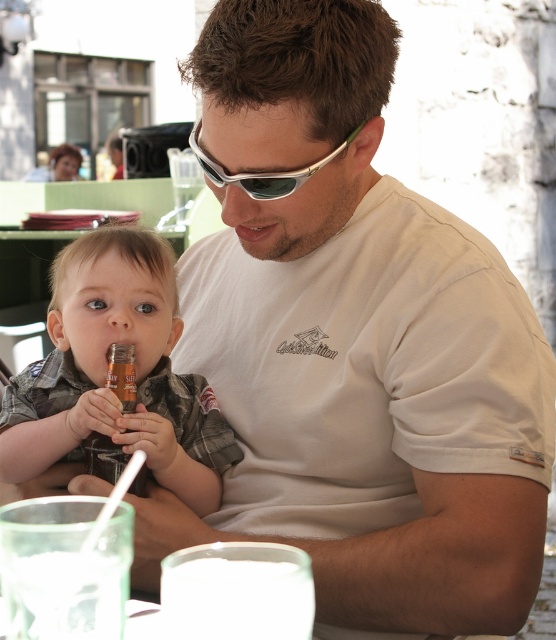
How far apart are matte plastic bottle at left and silver metallic sunglasses at center?

matte plastic bottle at left is 71.09 centimeters from silver metallic sunglasses at center.

Is point (76, 336) positioned after point (286, 177)?

Yes, it is behind point (286, 177).

Is point (210, 508) positioned behind point (246, 172)?

Yes, it is.

You are a GUI agent. You are given a task and a screenshot of the screen. Output one action in this format:
    pyautogui.click(x=<x>, y=<y>)
    Task: Click on the matte plastic bottle at left
    This screenshot has height=640, width=556.
    Given the screenshot: What is the action you would take?
    pyautogui.click(x=106, y=369)